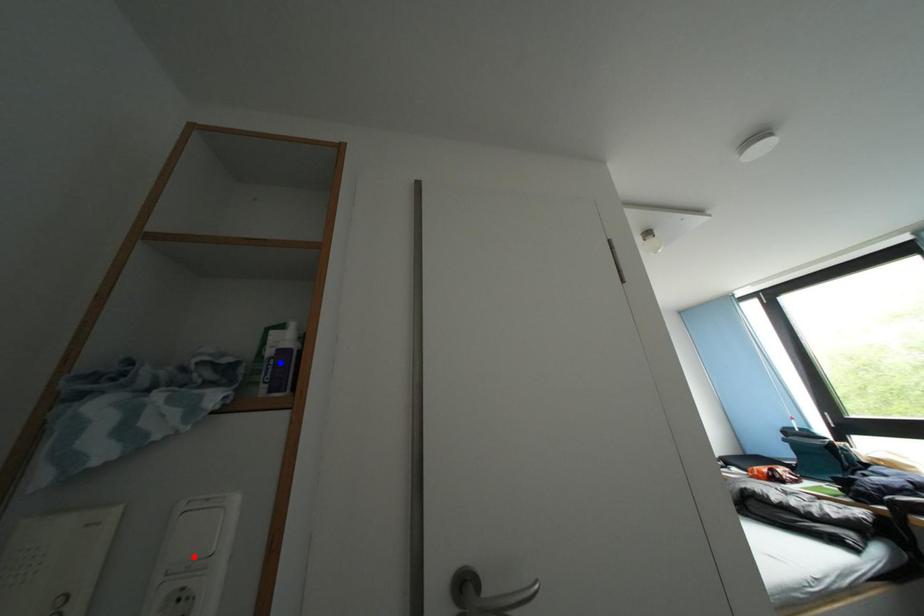
Question: In the image, two points are highlighted. Which point is nearer to the camera? Reply with the corresponding letter.

Choices:
 (A) blue point
 (B) red point

Answer: (B)